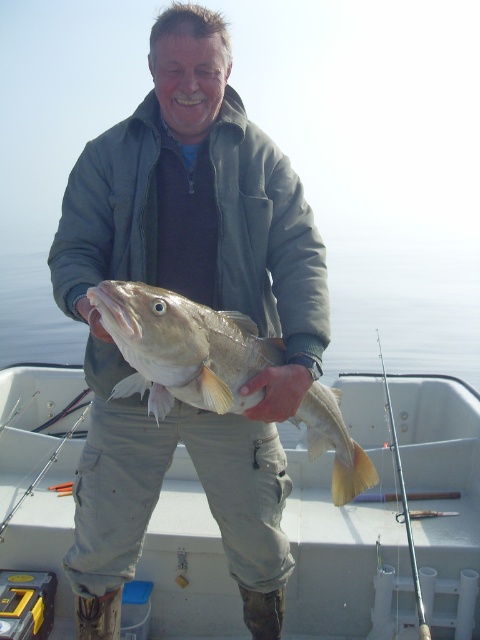
Question: Can you confirm if gray woolen jacket at center is smaller than white matte fish at center?

Choices:
 (A) no
 (B) yes

Answer: (B)

Question: Can you confirm if gray woolen jacket at center is wider than shiny silver fish at center?

Choices:
 (A) yes
 (B) no

Answer: (A)

Question: Is shiny silver fish at center below silver metallic fishing pole at right?

Choices:
 (A) yes
 (B) no

Answer: (B)

Question: Which object is positioned farthest from the gray woolen jacket at center?

Choices:
 (A) silver metallic fishing pole at right
 (B) white matte fish at center
 (C) shiny silver fish at center

Answer: (B)

Question: Based on their relative distances, which object is farther from the shiny silver fish at center?

Choices:
 (A) gray woolen jacket at center
 (B) silver metallic fishing pole at right
 (C) white matte fish at center

Answer: (C)

Question: Among these points, which one is farthest from the camera?

Choices:
 (A) (360, 620)
 (B) (242, 264)

Answer: (A)